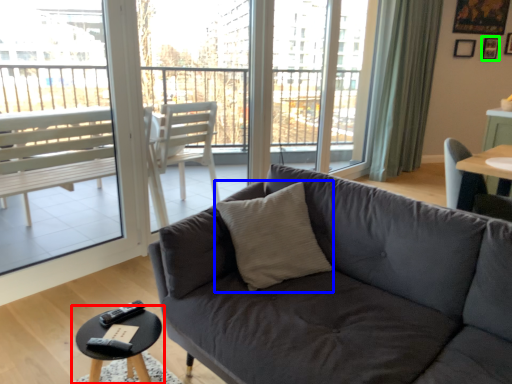
Question: Which is nearer to the coffee table (highlighted by a red box)? throw pillow (highlighted by a blue box) or picture frame (highlighted by a green box).

Choices:
 (A) throw pillow
 (B) picture frame

Answer: (A)